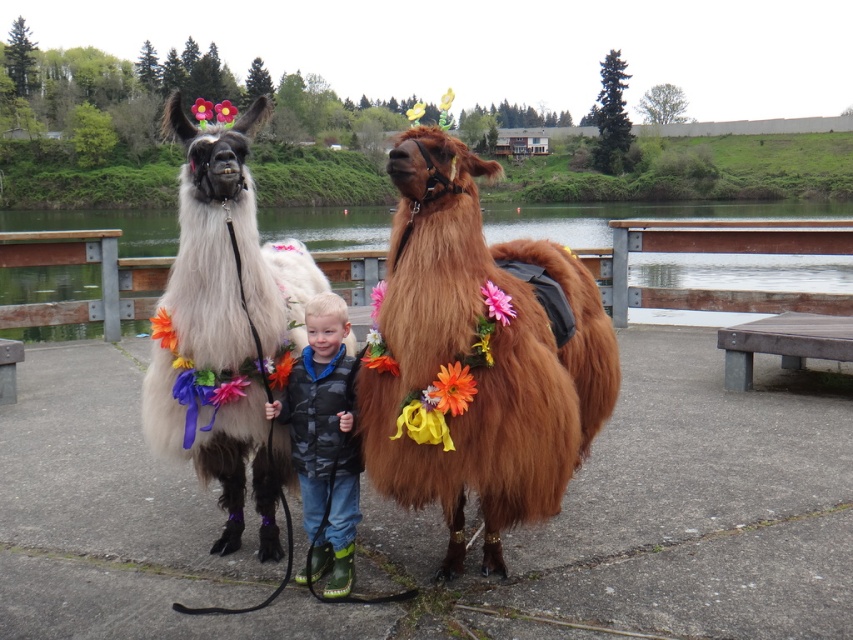
You are standing at point [399,179] and want to walk to the nearest llama. How far will you have to walk in feet?

The distance between the two llamas is 9.08 feet, so you will have to walk 4.54 feet to reach the nearest llama.

Consider the image. You are a photographer trying to capture a photo of the white fluffy alpaca at center. Based on its position coordinates, where should you aim your camera to ensure it is centered in the frame?

The white fluffy alpaca at center is located at point coordinates 0.516 along the x axis and 0.265 along the y axis, so you should aim your camera at those coordinates to center it in the frame.